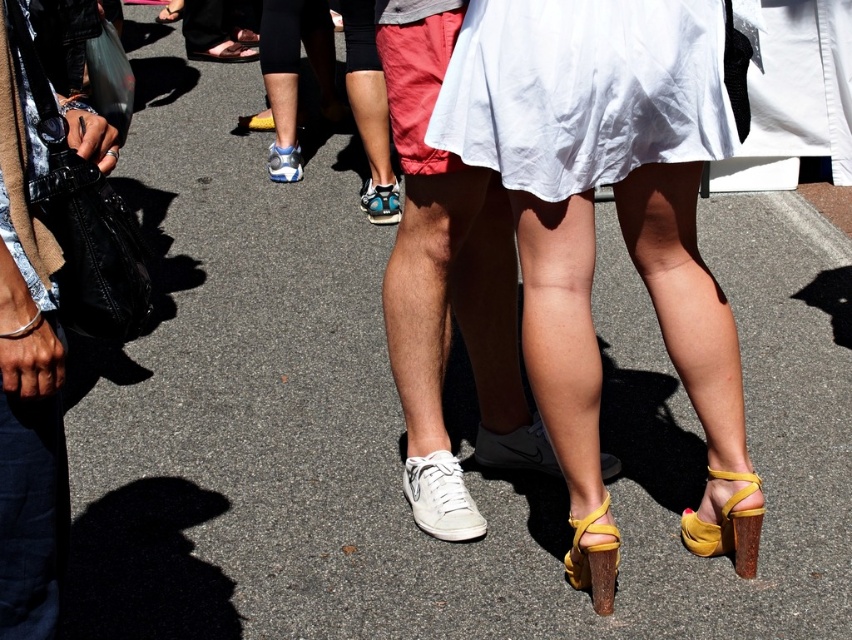
In the scene shown: You are a photographer trying to capture a candid shot of the white canvas sneaker at center without including the denim pants at left in the frame. Based on their positions, is this possible?

The denim pants at left are to the left of the white canvas sneaker at center, so if you position your camera to focus solely on the white canvas sneaker at center and avoid the left side of the frame, it should be possible to exclude the denim pants at left.

You are standing on the sidewalk and see the matte yellow sandal at lower right and the brown wooden heel at lower center. Which one is positioned more to the east if the sun is setting in the west?

The matte yellow sandal at lower right is to the right of the brown wooden heel at lower center. Since the sun is setting in the west, the right side of the image would correspond to the east. Therefore, the matte yellow sandal at lower right is positioned more to the east.